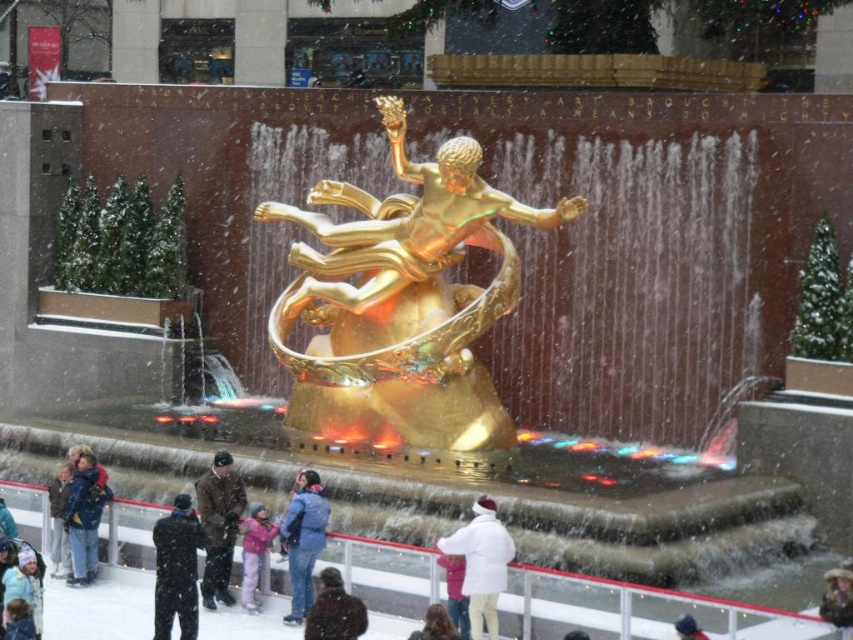
You are a photographer standing at the edge of the ice skating rink. You want to take a photo that includes both the matte blue jacket at center and the dark brown fur coat at lower center. Which of the two should you focus on first if you want to ensure both are in focus, considering their heights?

The matte blue jacket at center is taller than the dark brown fur coat at lower center. To ensure both are in focus, you should focus on the matte blue jacket at center first since it is taller and likely further away from the camera, requiring a greater depth of field.